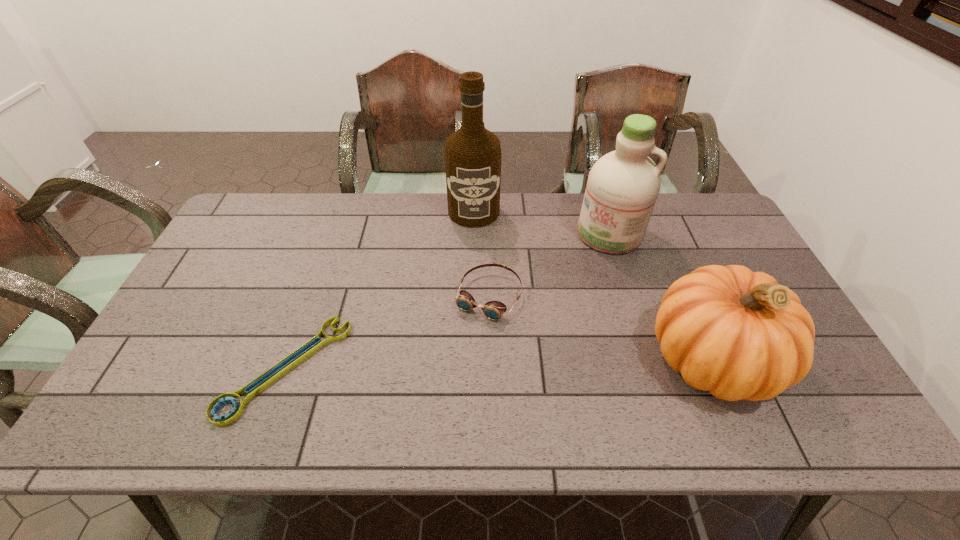
Locate an element on the screen. The width and height of the screenshot is (960, 540). wrench is located at coordinates (261, 382).

Where is `the shortest object`? the shortest object is located at coordinates coord(261,382).

The width and height of the screenshot is (960, 540). I want to click on the third shortest object, so click(738, 334).

The image size is (960, 540). What are the coordinates of `goggles` in the screenshot? It's located at (493, 310).

Identify the location of alcohol. This screenshot has width=960, height=540. (473, 155).

Locate an element on the screen. the second tallest object is located at coordinates (622, 188).

Identify the location of vacant region located 0.140m on the right of the leftmost object. [398, 368].

The image size is (960, 540). Find the location of `vacant position located 0.120m on the back of the third shortest object`. vacant position located 0.120m on the back of the third shortest object is located at coordinates (677, 277).

Identify the location of free space located 0.080m through the lenses of the goggles. (464, 345).

I want to click on vacant space located 0.190m through the lenses of the goggles, so click(444, 379).